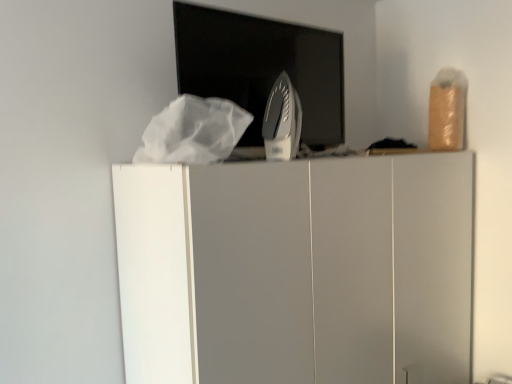
Locate an element on the screen. This screenshot has height=384, width=512. metallic iron at center is located at coordinates (262, 68).

In the scene shown: Can you confirm if white matte cabinet at center is wider than silver metallic iron at center?

Yes.

Between white matte cabinet at center and silver metallic iron at center, which one is positioned in front?

white matte cabinet at center is closer to the camera.

Is white matte cabinet at center positioned far away from silver metallic iron at center?

No, white matte cabinet at center is not far away from silver metallic iron at center.

From a real-world perspective, is white matte cabinet at center beneath silver metallic iron at center?

Yes, from a real-world perspective, white matte cabinet at center is under silver metallic iron at center.

Considering the sizes of white matte cabinet at center and metallic iron at center in the image, is white matte cabinet at center taller or shorter than metallic iron at center?

Clearly, white matte cabinet at center is taller compared to metallic iron at center.

From the image's perspective, is white matte cabinet at center on top of metallic iron at center?

No, from the image's perspective, white matte cabinet at center is not on top of metallic iron at center.

Consider the image. Can you tell me how much white matte cabinet at center and metallic iron at center differ in facing direction?

There is a 1.13-degree angle between the facing directions of white matte cabinet at center and metallic iron at center.

Is white matte cabinet at center positioned with its back to metallic iron at center?

No.

Between metallic iron at center and white matte cabinet at center, which one has less height?

metallic iron at center is shorter.

Looking at their sizes, would you say metallic iron at center is wider or thinner than white matte cabinet at center?

metallic iron at center is thinner than white matte cabinet at center.

In the scene shown: Is white matte cabinet at center at the back of metallic iron at center?

No, metallic iron at center is not facing the opposite direction of white matte cabinet at center.

Choose the correct answer: Is metallic iron at center inside white matte cabinet at center or outside it?

metallic iron at center is spatially situated outside white matte cabinet at center.

In the scene shown: In terms of height, does silver metallic iron at center look taller or shorter compared to metallic iron at center?

Clearly, silver metallic iron at center is shorter compared to metallic iron at center.

Is silver metallic iron at center outside of metallic iron at center?

Yes, silver metallic iron at center is not within metallic iron at center.

Considering the relative sizes of silver metallic iron at center and metallic iron at center in the image provided, is silver metallic iron at center smaller than metallic iron at center?

Yes, silver metallic iron at center is smaller than metallic iron at center.

How many degrees apart are the facing directions of silver metallic iron at center and metallic iron at center?

silver metallic iron at center and metallic iron at center are facing 1.4 degrees away from each other.

From a real-world perspective, which object rests below the other?

white matte cabinet at center.

Is white matte cabinet at center surrounded by silver metallic iron at center?

No, white matte cabinet at center is not inside silver metallic iron at center.

Is silver metallic iron at center oriented away from white matte cabinet at center?

No.

Between silver metallic iron at center and white matte cabinet at center, which one appears on the right side from the viewer's perspective?

white matte cabinet at center.

Which point is more forward, (259, 132) or (273, 118)?

The point (259, 132) is more forward.

Is metallic iron at center wider or thinner than silver metallic iron at center?

In the image, metallic iron at center appears to be more narrow than silver metallic iron at center.

Which is correct: metallic iron at center is inside silver metallic iron at center, or outside of it?

metallic iron at center exists outside the volume of silver metallic iron at center.

Identify the location of furniture in front of the silver metallic iron at center. (297, 270).

At what (x,y) coordinates should I click in order to perform the action: click on appliance located above the white matte cabinet at center (from the image's perspective). Please return your answer as a coordinate pair (x, y). This screenshot has height=384, width=512. Looking at the image, I should click on (262, 68).

When comparing their distances from metallic iron at center, does white matte cabinet at center or silver metallic iron at center seem closer?

silver metallic iron at center is positioned closer to the anchor metallic iron at center.

Estimate the real-world distances between objects in this image. Which object is further from silver metallic iron at center, metallic iron at center or white matte cabinet at center?

white matte cabinet at center lies further to silver metallic iron at center than the other object.

Based on their spatial positions, is white matte cabinet at center or metallic iron at center closer to silver metallic iron at center?

metallic iron at center lies closer to silver metallic iron at center than the other object.

Estimate the real-world distances between objects in this image. Which object is closer to white matte cabinet at center, silver metallic iron at center or metallic iron at center?

metallic iron at center.

Estimate the real-world distances between objects in this image. Which object is further from metallic iron at center, silver metallic iron at center or white matte cabinet at center?

white matte cabinet at center is further to metallic iron at center.

When comparing their distances from white matte cabinet at center, does metallic iron at center or silver metallic iron at center seem closer?

Based on the image, metallic iron at center appears to be nearer to white matte cabinet at center.

You are a GUI agent. You are given a task and a screenshot of the screen. Output one action in this format:
    pyautogui.click(x=<x>, y=<y>)
    Task: Click on the home appliance between metallic iron at center and white matte cabinet at center from top to bottom
    
    Given the screenshot: What is the action you would take?
    click(282, 121)